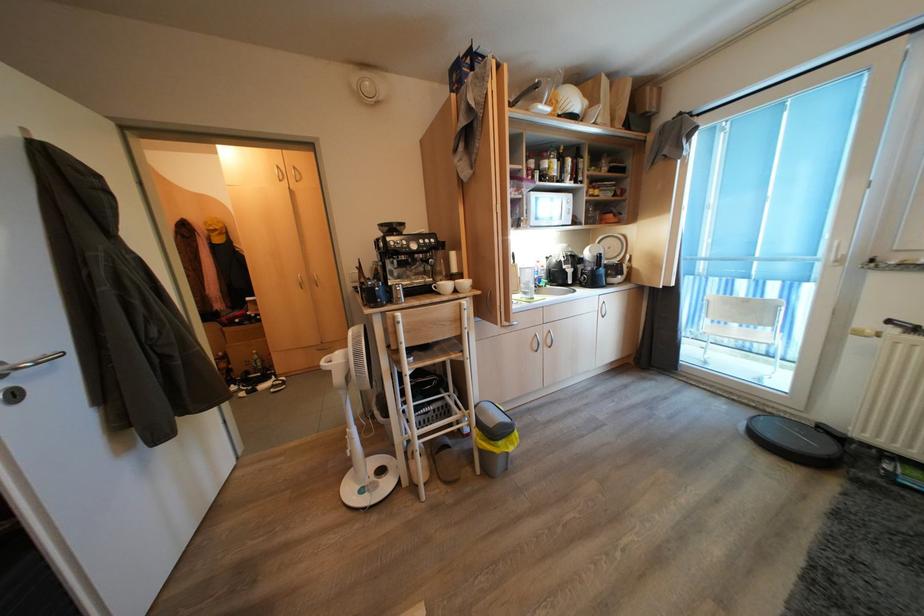
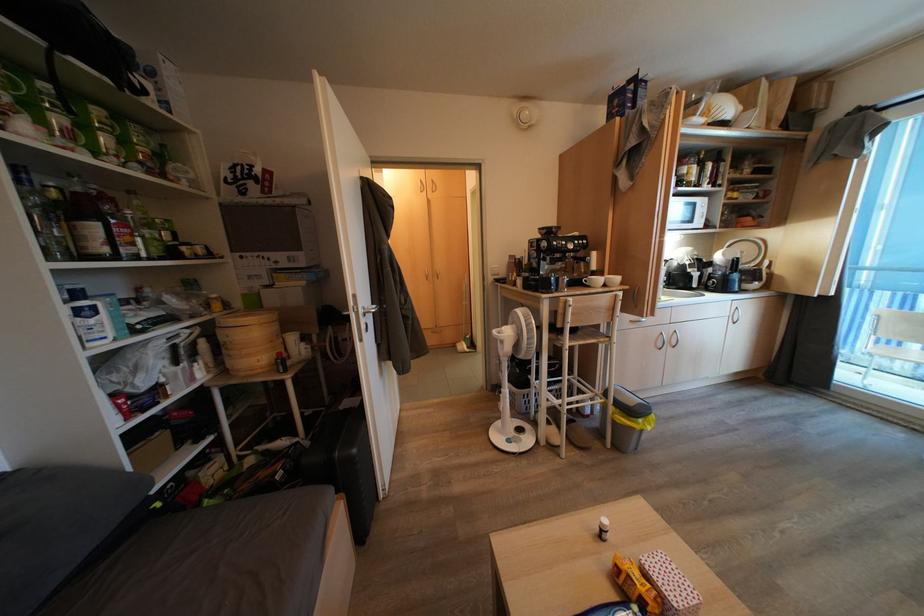
Find the pixel in the second image that matches (x=548, y=349) in the first image.

(672, 347)